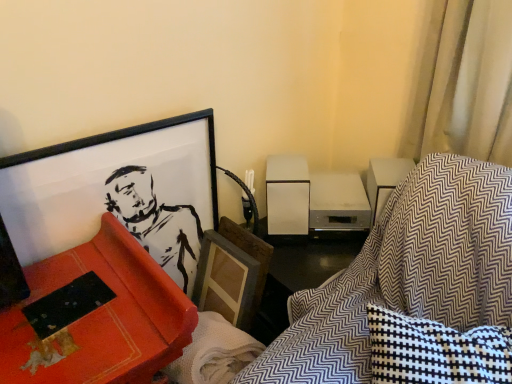
Where is `textured fabric swivel chair at lower right`? textured fabric swivel chair at lower right is located at coordinates (406, 274).

You are a GUI agent. You are given a task and a screenshot of the screen. Output one action in this format:
    pyautogui.click(x=<x>, y=<y>)
    Task: Click on the matte black picture frame at upper left
    The image size is (512, 384).
    Given the screenshot: What is the action you would take?
    pyautogui.click(x=117, y=192)

This screenshot has width=512, height=384. In the image, there is a matte red bookshelf at left. What are the coordinates of `swivel chair above it (from the image's perspective)` in the screenshot? It's located at (406, 274).

Which object is closer to the camera taking this photo, textured fabric swivel chair at lower right or matte red bookshelf at left?

textured fabric swivel chair at lower right.

Does point (506, 208) come behind point (123, 328)?

Yes, point (506, 208) is farther from viewer.

Looking at the image, does textured fabric swivel chair at lower right seem bigger or smaller compared to matte red bookshelf at left?

textured fabric swivel chair at lower right is smaller than matte red bookshelf at left.

Considering the relative positions of matte black picture frame at upper left and matte red bookshelf at left in the image provided, is matte black picture frame at upper left behind matte red bookshelf at left?

Yes, matte black picture frame at upper left is further from the camera.

From a real-world perspective, who is located higher, matte black picture frame at upper left or matte red bookshelf at left?

matte black picture frame at upper left is physically above.

From the image's perspective, is matte black picture frame at upper left under matte red bookshelf at left?

No, from the image's perspective, matte black picture frame at upper left is not beneath matte red bookshelf at left.

Which of these two, matte black picture frame at upper left or matte red bookshelf at left, stands shorter?

With less height is matte red bookshelf at left.

Considering the positions of points (14, 227) and (451, 210), is point (14, 227) farther from camera compared to point (451, 210)?

That is False.

Is matte black picture frame at upper left positioned beyond the bounds of textured fabric swivel chair at lower right?

Yes, matte black picture frame at upper left is located beyond the bounds of textured fabric swivel chair at lower right.

Who is taller, matte black picture frame at upper left or textured fabric swivel chair at lower right?

matte black picture frame at upper left.

Is matte black picture frame at upper left facing towards textured fabric swivel chair at lower right?

Yes, matte black picture frame at upper left faces towards textured fabric swivel chair at lower right.

How many degrees apart are the facing directions of textured fabric swivel chair at lower right and matte black picture frame at upper left?

The facing directions of textured fabric swivel chair at lower right and matte black picture frame at upper left are 44.6 degrees apart.

Is point (458, 216) closer to viewer compared to point (112, 157)?

Yes, point (458, 216) is closer to viewer.

Which is more to the right, textured fabric swivel chair at lower right or matte black picture frame at upper left?

textured fabric swivel chair at lower right is more to the right.

From the picture: How much distance is there between textured fabric swivel chair at lower right and matte black picture frame at upper left?

textured fabric swivel chair at lower right and matte black picture frame at upper left are 23.56 inches apart from each other.

Does matte red bookshelf at left have a smaller size compared to matte black picture frame at upper left?

No, matte red bookshelf at left is not smaller than matte black picture frame at upper left.

Is matte red bookshelf at left directly adjacent to matte black picture frame at upper left?

They are not placed beside each other.

Does matte red bookshelf at left have a greater width compared to matte black picture frame at upper left?

Correct, the width of matte red bookshelf at left exceeds that of matte black picture frame at upper left.

From the image's perspective, is matte red bookshelf at left below matte black picture frame at upper left?

Yes, from the image's perspective, matte red bookshelf at left is below matte black picture frame at upper left.

Can you confirm if matte red bookshelf at left is bigger than textured fabric swivel chair at lower right?

Yes, matte red bookshelf at left is bigger than textured fabric swivel chair at lower right.

From a real-world perspective, between matte red bookshelf at left and textured fabric swivel chair at lower right, who is vertically higher?

textured fabric swivel chair at lower right is physically above.

From the image's perspective, does matte red bookshelf at left appear lower than textured fabric swivel chair at lower right?

Correct, matte red bookshelf at left appears lower than textured fabric swivel chair at lower right in the image.

The height and width of the screenshot is (384, 512). What are the coordinates of `furniture on the left side of textured fabric swivel chair at lower right` in the screenshot? It's located at coord(109,310).

You are a GUI agent. You are given a task and a screenshot of the screen. Output one action in this format:
    pyautogui.click(x=<x>, y=<y>)
    Task: Click on the furniture below the matte black picture frame at upper left (from a real-world perspective)
    
    Given the screenshot: What is the action you would take?
    pyautogui.click(x=109, y=310)

Based on their spatial positions, is textured fabric swivel chair at lower right or matte black picture frame at upper left further from matte red bookshelf at left?

textured fabric swivel chair at lower right lies further to matte red bookshelf at left than the other object.

From the image, which object appears to be nearer to textured fabric swivel chair at lower right, matte red bookshelf at left or matte black picture frame at upper left?

matte red bookshelf at left lies closer to textured fabric swivel chair at lower right than the other object.

Which object lies nearer to the anchor point matte black picture frame at upper left, matte red bookshelf at left or textured fabric swivel chair at lower right?

Among the two, matte red bookshelf at left is located nearer to matte black picture frame at upper left.

Which object lies further to the anchor point matte red bookshelf at left, matte black picture frame at upper left or textured fabric swivel chair at lower right?

textured fabric swivel chair at lower right lies further to matte red bookshelf at left than the other object.

Based on the photo, from the image, which object appears to be nearer to matte black picture frame at upper left, textured fabric swivel chair at lower right or matte red bookshelf at left?

matte red bookshelf at left is positioned closer to the anchor matte black picture frame at upper left.

From the picture: From the image, which object appears to be farther from textured fabric swivel chair at lower right, matte black picture frame at upper left or matte red bookshelf at left?

Among the two, matte black picture frame at upper left is located further to textured fabric swivel chair at lower right.

Where is `picture frame between matte red bookshelf at left and textured fabric swivel chair at lower right from left to right`? The image size is (512, 384). picture frame between matte red bookshelf at left and textured fabric swivel chair at lower right from left to right is located at coordinates (117, 192).